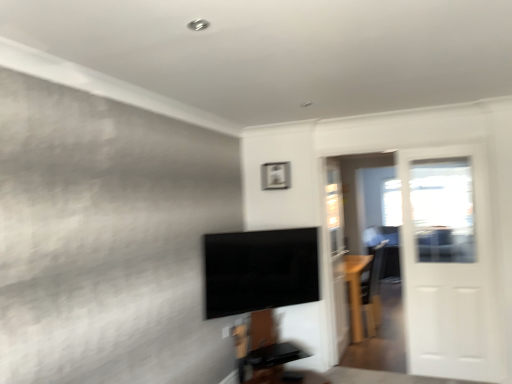
Question: Is black glossy tv at center wider than white glossy door at right?

Choices:
 (A) yes
 (B) no

Answer: (A)

Question: Would you consider black glossy tv at center to be distant from white glossy door at right?

Choices:
 (A) no
 (B) yes

Answer: (B)

Question: Is black glossy tv at center to the left of white glossy door at right from the viewer's perspective?

Choices:
 (A) yes
 (B) no

Answer: (A)

Question: Does black glossy tv at center turn towards white glossy door at right?

Choices:
 (A) yes
 (B) no

Answer: (B)

Question: Is black glossy tv at center further to the viewer compared to white glossy door at right?

Choices:
 (A) yes
 (B) no

Answer: (B)

Question: Is matte silver picture frame at upper center taller or shorter than black glossy tv at center?

Choices:
 (A) tall
 (B) short

Answer: (B)

Question: From a real-world perspective, is matte silver picture frame at upper center positioned above or below black glossy tv at center?

Choices:
 (A) below
 (B) above

Answer: (B)

Question: From the image's perspective, is matte silver picture frame at upper center above or below black glossy tv at center?

Choices:
 (A) above
 (B) below

Answer: (A)

Question: In terms of size, does matte silver picture frame at upper center appear bigger or smaller than black glossy tv at center?

Choices:
 (A) big
 (B) small

Answer: (B)

Question: Is matte silver picture frame at upper center taller or shorter than white glossy door at right?

Choices:
 (A) short
 (B) tall

Answer: (A)

Question: Is matte silver picture frame at upper center wider or thinner than white glossy door at right?

Choices:
 (A) thin
 (B) wide

Answer: (A)

Question: Is point (269, 187) positioned closer to the camera than point (419, 342)?

Choices:
 (A) closer
 (B) farther

Answer: (B)

Question: Is matte silver picture frame at upper center inside the boundaries of white glossy door at right, or outside?

Choices:
 (A) inside
 (B) outside

Answer: (B)

Question: From a real-world perspective, is black glossy tv at center positioned above or below light brown wood table at right?

Choices:
 (A) above
 (B) below

Answer: (A)

Question: Considering the positions of black glossy tv at center and light brown wood table at right in the image, is black glossy tv at center bigger or smaller than light brown wood table at right?

Choices:
 (A) big
 (B) small

Answer: (B)